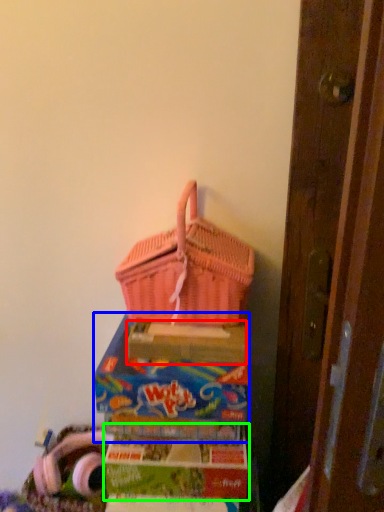
Question: Estimate the real-world distances between objects in this image. Which object is closer to cardboard box (highlighted by a red box), box (highlighted by a blue box) or box (highlighted by a green box)?

Choices:
 (A) box
 (B) box

Answer: (A)